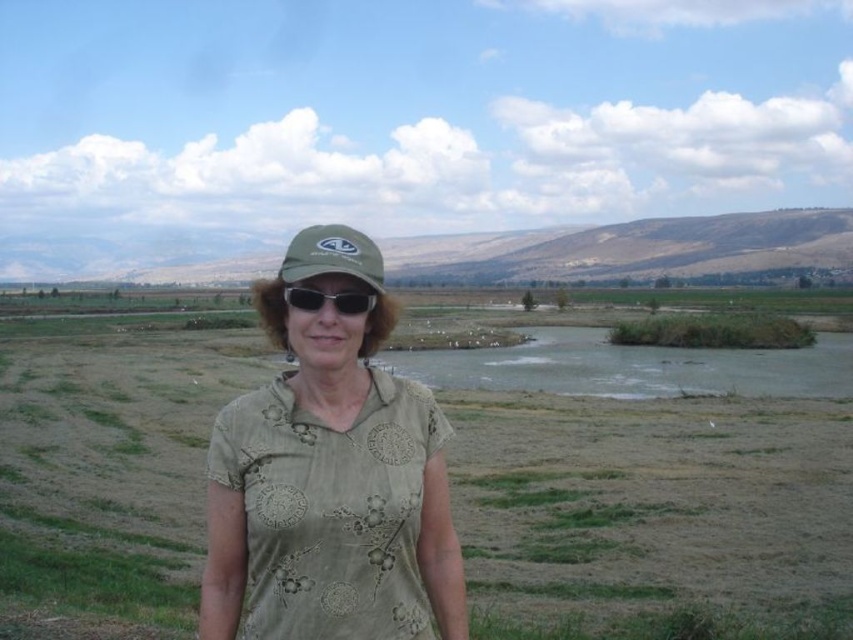
Can you confirm if green fabric shirt at center is shorter than black matte sunglasses at center?

No.

Measure the distance from green fabric shirt at center to black matte sunglasses at center.

They are 63.35 centimeters apart.

Is point (367, 490) more distant than point (341, 305)?

No.

The image size is (853, 640). I want to click on green fabric shirt at center, so [x=329, y=476].

Is green fabric baseball cap at center smaller than black matte sunglasses at center?

Actually, green fabric baseball cap at center might be larger than black matte sunglasses at center.

The height and width of the screenshot is (640, 853). I want to click on green fabric baseball cap at center, so click(332, 256).

Between green fabric shirt at center and green fabric baseball cap at center, which one is positioned lower?

green fabric shirt at center is below.

Looking at this image, which is above, green fabric shirt at center or green fabric baseball cap at center?

green fabric baseball cap at center

Is point (431, 493) positioned after point (312, 250)?

That is True.

At what (x,y) coordinates should I click in order to perform the action: click on green fabric shirt at center. Please return your answer as a coordinate pair (x, y). Looking at the image, I should click on (329, 476).